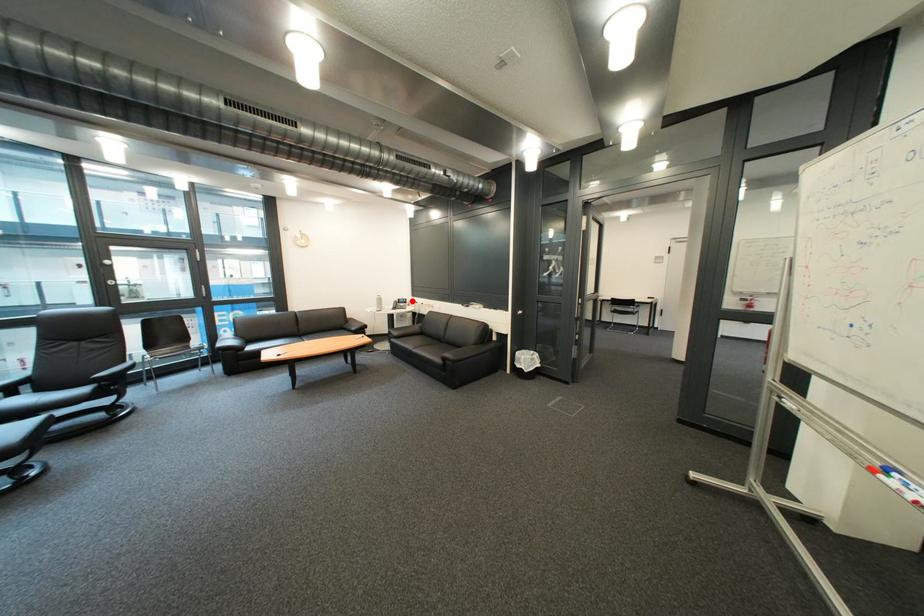
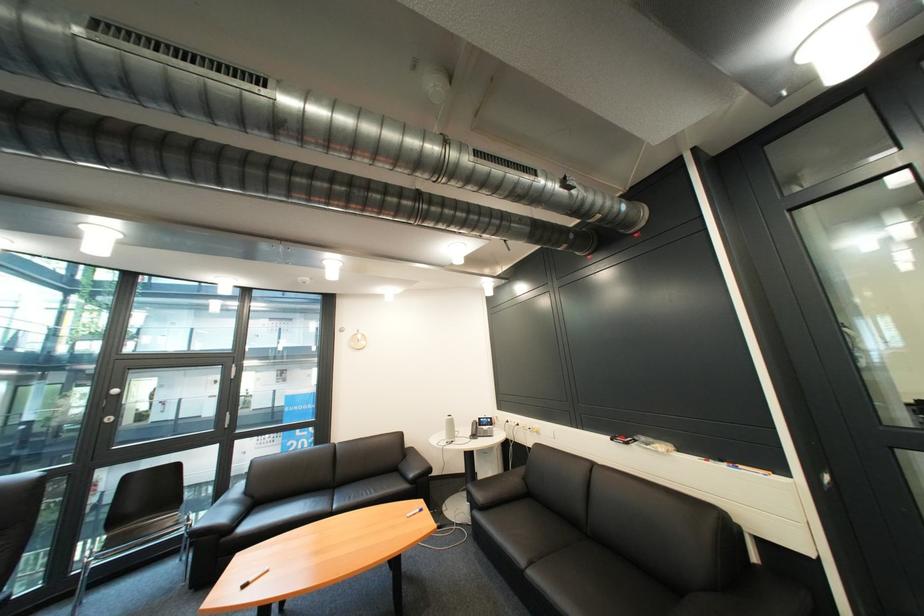
The point at the highlighted location is marked in the first image. Where is the corresponding point in the second image?

(492, 419)